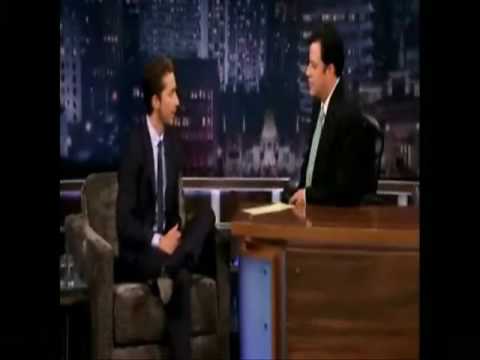
At what (x,y) coordinates should I click in order to perform the action: click on side table. Please return your answer as a coordinate pair (x, y). Looking at the image, I should click on (72, 301).